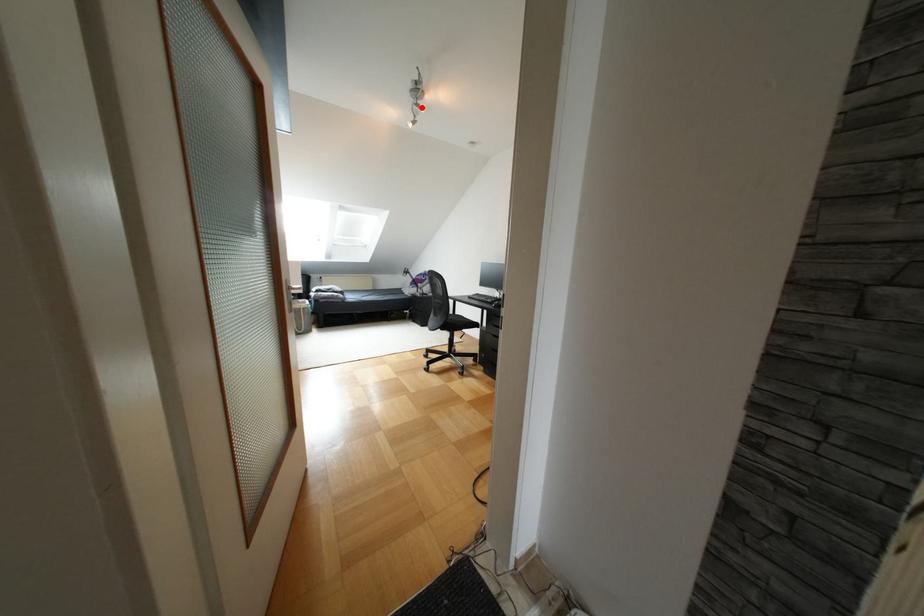
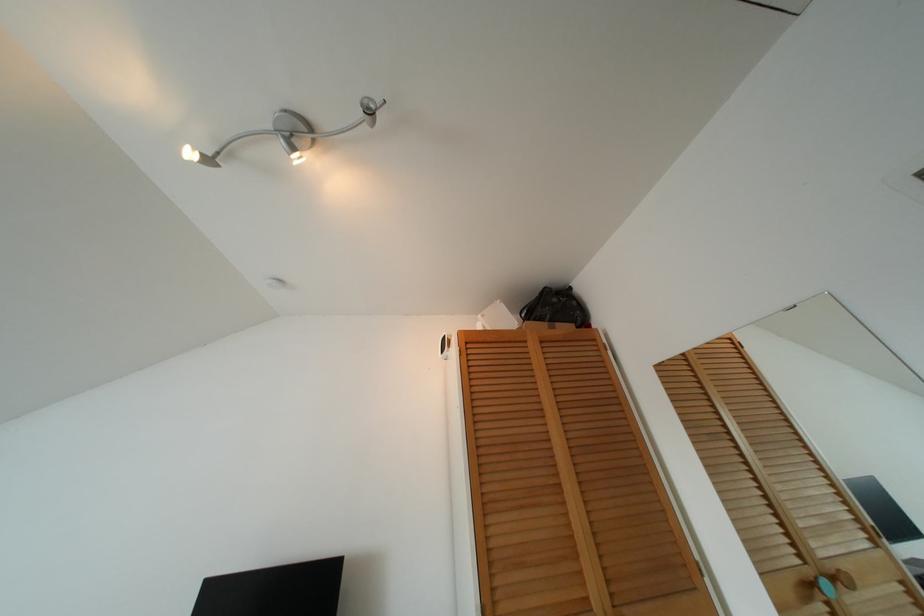
Where in the second image is the point corresponding to the highlighted location from the first image?

(297, 158)